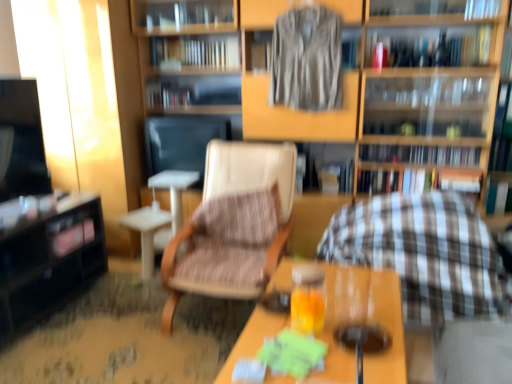
Question: Is translucent glass beverage at center located outside hardcover books at upper center, acting as the 2th book starting from the bottom?

Choices:
 (A) yes
 (B) no

Answer: (A)

Question: Is translucent glass beverage at center directly adjacent to hardcover books at upper center, acting as the 2th book starting from the bottom?

Choices:
 (A) yes
 (B) no

Answer: (B)

Question: Does translucent glass beverage at center appear on the right side of hardcover books at upper center, the 5th book viewed from the top?

Choices:
 (A) yes
 (B) no

Answer: (B)

Question: From a real-world perspective, is translucent glass beverage at center below hardcover books at upper center, acting as the 2th book starting from the bottom?

Choices:
 (A) no
 (B) yes

Answer: (B)

Question: Does translucent glass beverage at center have a larger size compared to hardcover books at upper center, acting as the 2th book starting from the bottom?

Choices:
 (A) yes
 (B) no

Answer: (B)

Question: Do you think hardcover book at upper center, acting as the first book starting from the top, is within wooden bookshelf at center, or outside of it?

Choices:
 (A) outside
 (B) inside

Answer: (B)

Question: From a real-world perspective, is hardcover book at upper center, acting as the first book starting from the top, positioned above or below wooden bookshelf at center?

Choices:
 (A) below
 (B) above

Answer: (B)

Question: Considering the positions of point (197, 41) and point (490, 71), is point (197, 41) closer or farther from the camera than point (490, 71)?

Choices:
 (A) closer
 (B) farther

Answer: (B)

Question: Based on their sizes in the image, would you say hardcover book at upper center, which appears as the sixth book when ordered from the bottom, is bigger or smaller than wooden bookshelf at center?

Choices:
 (A) small
 (B) big

Answer: (A)

Question: Visually, is hardcover book at center, the 3th book ordered from the bottom, positioned to the left or to the right of black glossy table at left, acting as the first table starting from the left?

Choices:
 (A) right
 (B) left

Answer: (A)

Question: Is point (179, 94) positioned closer to the camera than point (64, 218)?

Choices:
 (A) farther
 (B) closer

Answer: (A)

Question: From the image's perspective, is hardcover book at center, acting as the fourth book starting from the top, above or below black glossy table at left, arranged as the 2th table when viewed from the right?

Choices:
 (A) above
 (B) below

Answer: (A)

Question: Is hardcover book at center, the 3th book ordered from the bottom, wider or thinner than black glossy table at left, arranged as the 2th table when viewed from the right?

Choices:
 (A) wide
 (B) thin

Answer: (B)

Question: Would you say striped fabric book at center, acting as the fifth book starting from the bottom, is inside or outside translucent glass beverage at center?

Choices:
 (A) inside
 (B) outside

Answer: (B)

Question: Is striped fabric book at center, acting as the fifth book starting from the bottom, taller or shorter than translucent glass beverage at center?

Choices:
 (A) tall
 (B) short

Answer: (A)